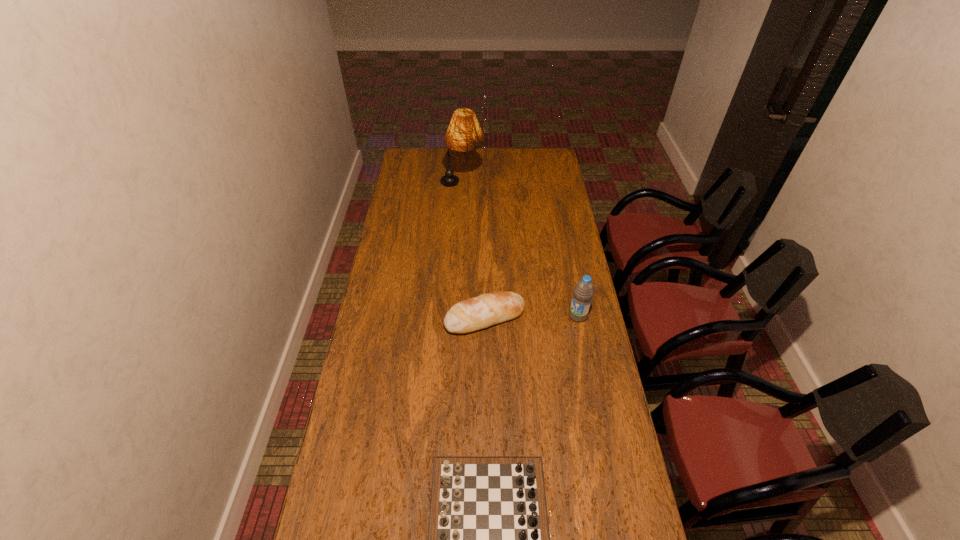
The width and height of the screenshot is (960, 540). In order to click on the tallest object in this screenshot , I will do `click(464, 133)`.

Find the location of a particular element. This screenshot has width=960, height=540. lampshade is located at coordinates (464, 133).

You are a GUI agent. You are given a task and a screenshot of the screen. Output one action in this format:
    pyautogui.click(x=<x>, y=<y>)
    Task: Click on the rightmost object
    
    Given the screenshot: What is the action you would take?
    pyautogui.click(x=584, y=290)

This screenshot has width=960, height=540. Find the location of `the third shortest object`. the third shortest object is located at coordinates (584, 290).

Find the location of a particular element. The width and height of the screenshot is (960, 540). the third tallest object is located at coordinates (488, 309).

Image resolution: width=960 pixels, height=540 pixels. I want to click on blank space located 0.210m on the front-facing side of the tallest object, so click(524, 185).

The height and width of the screenshot is (540, 960). I want to click on vacant space positioned 0.350m on the front of the water bottle, so click(595, 406).

At what (x,y) coordinates should I click in order to perform the action: click on vacant area situated 0.300m on the back of the second shortest object. Please return your answer as a coordinate pair (x, y). The height and width of the screenshot is (540, 960). Looking at the image, I should click on (484, 250).

This screenshot has height=540, width=960. Identify the location of object located at the right edge. (584, 290).

Identify the location of free space at the far edge of the desktop. (522, 165).